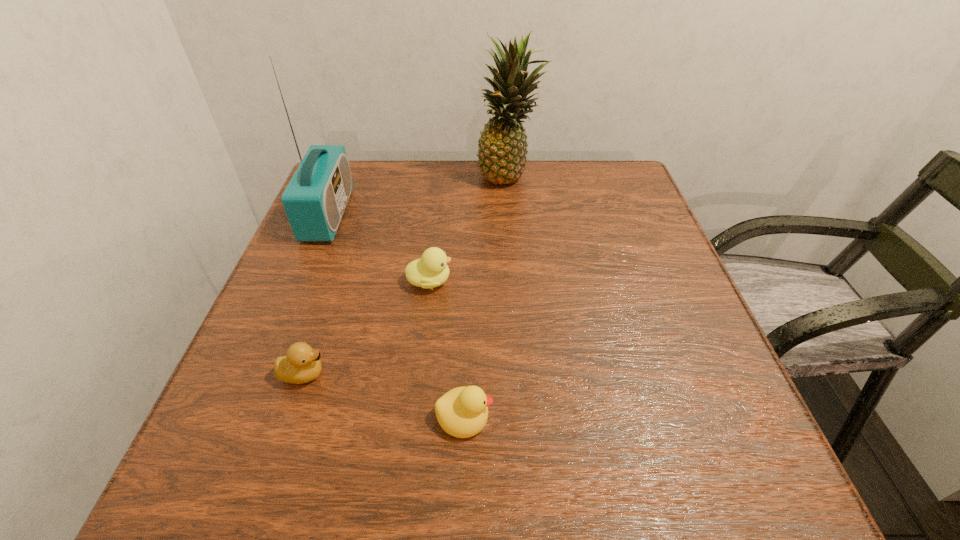
Image resolution: width=960 pixels, height=540 pixels. In order to click on pineapple in this screenshot , I will do 502,146.

Identify the location of radio receiver. (315, 199).

I want to click on the farthest duckling, so click(431, 270).

I want to click on the fourth farthest object, so click(x=302, y=364).

At what (x,y) coordinates should I click in order to perform the action: click on the leftmost duckling. Please return your answer as a coordinate pair (x, y). This screenshot has height=540, width=960. Looking at the image, I should click on (302, 364).

Where is `the nearest object`? The image size is (960, 540). the nearest object is located at coordinates (462, 412).

Where is `free location located 0.050m on the left of the pineapple`? This screenshot has width=960, height=540. free location located 0.050m on the left of the pineapple is located at coordinates (458, 177).

What are the coordinates of `free space located on the front panel of the radio receiver` in the screenshot? It's located at (444, 214).

The width and height of the screenshot is (960, 540). I want to click on free space located at the beak of the farthest duckling, so click(x=644, y=281).

Identify the location of free location located on the face of the leftmost duckling. The image size is (960, 540). (567, 374).